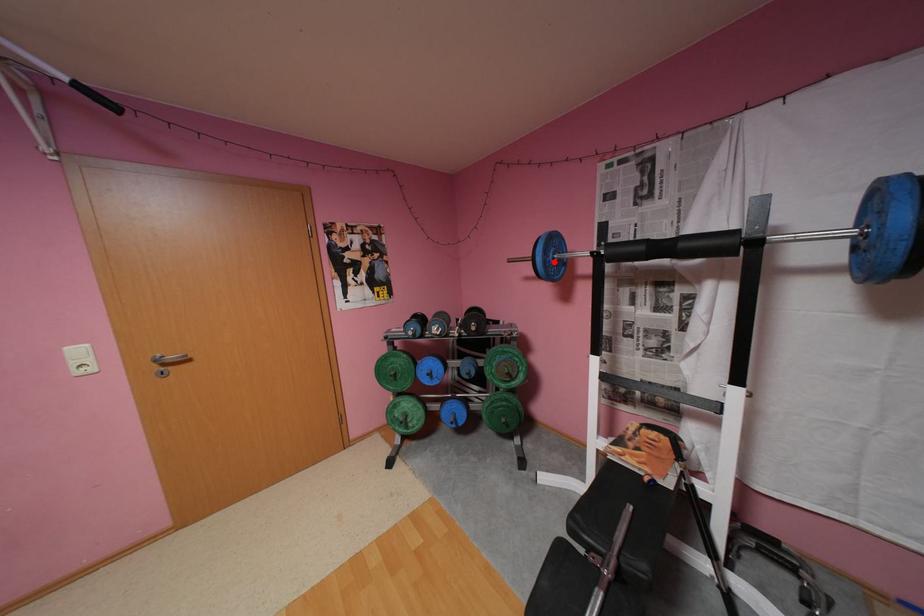
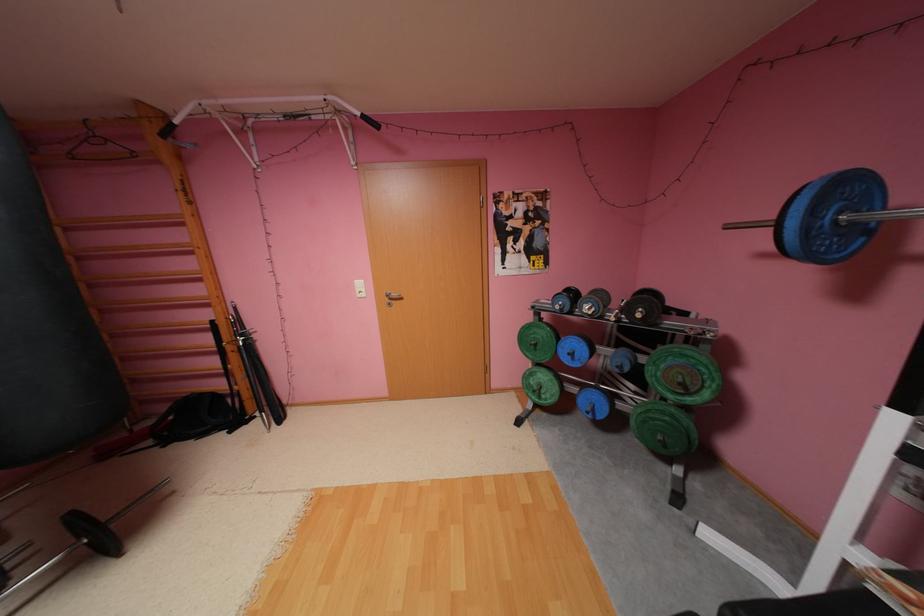
Where in the second image is the point corresponding to the highlighted location from the first image?

(816, 229)